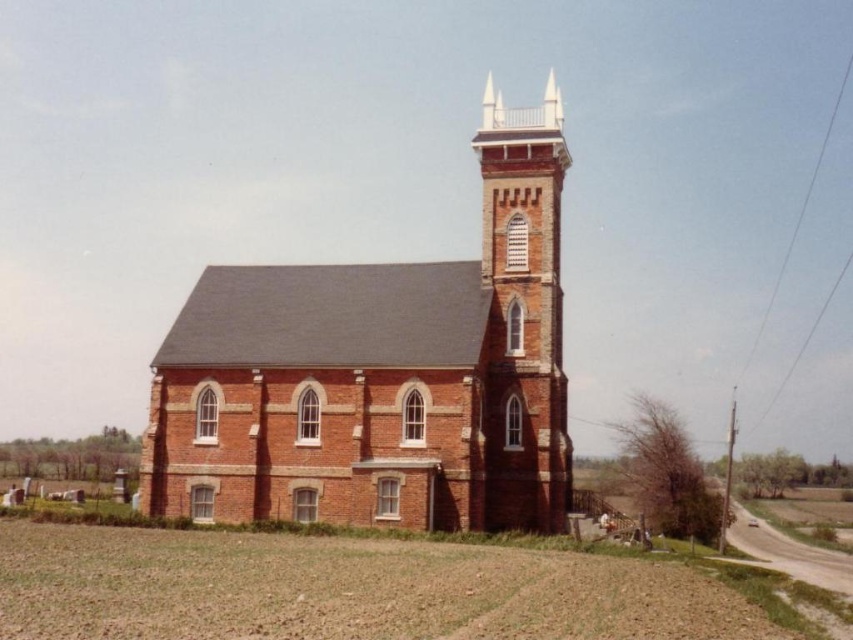
Between point (271, 481) and point (498, 500), which one is positioned in front?

Point (271, 481)

Between brick church at center and brick steeple at upper right, which one has more height?

brick steeple at upper right

Measure the distance between brick church at center and camera.

The distance of brick church at center from camera is 61.65 meters.

Where is `brick church at center`? brick church at center is located at coordinates [x=381, y=372].